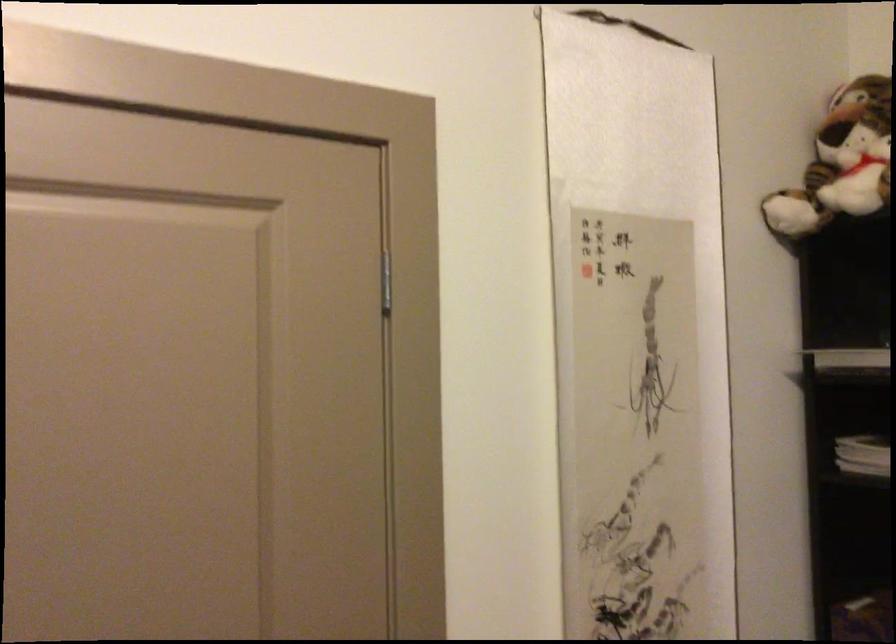
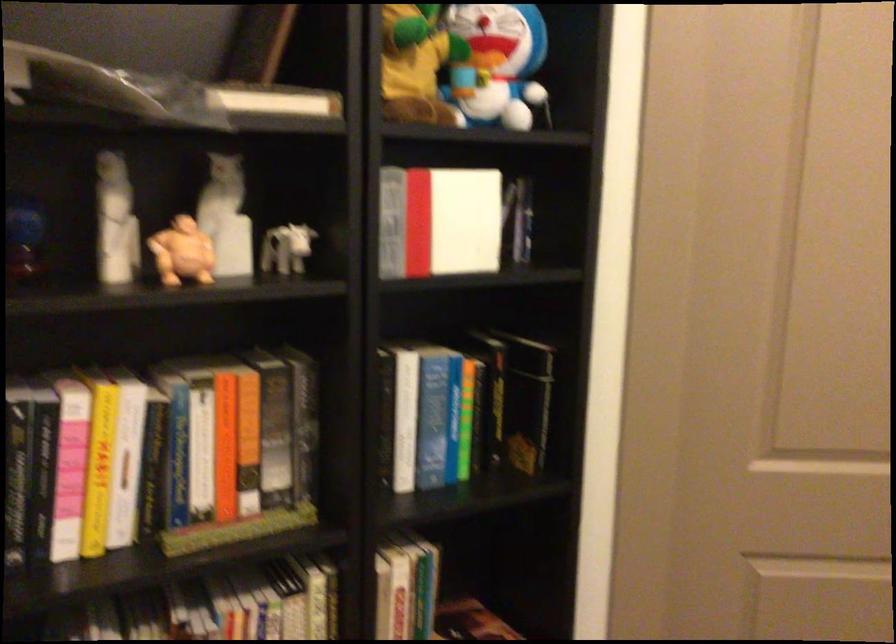
Question: Based on the continuous images, in which direction is the camera rotating? Reply with the corresponding letter.

Choices:
 (A) Left
 (B) Right
 (C) Up
 (D) Down

Answer: (B)